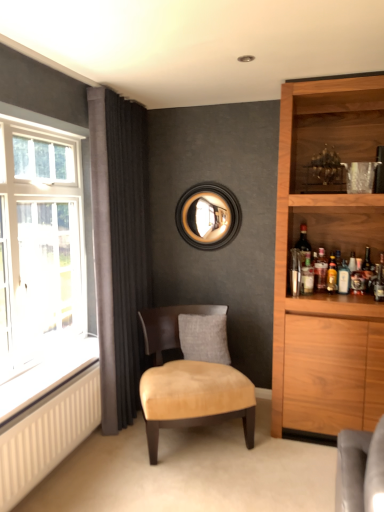
What do you see at coordinates (320, 270) in the screenshot? Image resolution: width=384 pixels, height=512 pixels. I see `translucent glass bottle at right, positioned as the second bottle in left-to-right order` at bounding box center [320, 270].

You are a GUI agent. You are given a task and a screenshot of the screen. Output one action in this format:
    pyautogui.click(x=<x>, y=<y>)
    Task: Click on the translucent glass bottle at right, which is the second bottle from right to left
    The width and height of the screenshot is (384, 512).
    Given the screenshot: What is the action you would take?
    pyautogui.click(x=320, y=270)

Locate an element on the screen. dark grey velvet curtains at left is located at coordinates pyautogui.click(x=119, y=248).

Image resolution: width=384 pixels, height=512 pixels. I want to click on suede-like beige chair at center, so click(189, 382).

Describe the element at coordinates (303, 244) in the screenshot. The image size is (384, 512). I see `matte dark brown wine bottle at right` at that location.

Where is `black wood mirror at upper center`? The image size is (384, 512). black wood mirror at upper center is located at coordinates (208, 216).

From the image's perspective, is suede-like beige chair at center positioned above or below translucent glass bottle at right, the 1th bottle in the left-to-right sequence?

Based on their image positions, suede-like beige chair at center is located beneath translucent glass bottle at right, the 1th bottle in the left-to-right sequence.

Is suede-like beige chair at center shorter than translucent glass bottle at right, the 1th bottle in the left-to-right sequence?

No, suede-like beige chair at center is not shorter than translucent glass bottle at right, the 1th bottle in the left-to-right sequence.

Who is bigger, matte dark brown wine bottle at right or clear glass window at left?

Bigger between the two is clear glass window at left.

From a real-world perspective, between matte dark brown wine bottle at right and clear glass window at left, who is vertically lower?

matte dark brown wine bottle at right.

How many degrees apart are the facing directions of matte dark brown wine bottle at right and clear glass window at left?

The facing directions of matte dark brown wine bottle at right and clear glass window at left are 86.7 degrees apart.

In the image, there is a clear glass window at left. At what (x,y) coordinates should I click in order to perform the action: click on wine bottle above it (from the image's perspective). Please return your answer as a coordinate pair (x, y). The height and width of the screenshot is (512, 384). Looking at the image, I should click on (303, 244).

How different are the orientations of translucent glass bottle at right, which is the second bottle from right to left, and black wood mirror at upper center in degrees?

They differ by 1.81 degrees in their facing directions.

From a real-world perspective, which is physically below, translucent glass bottle at right, positioned as the second bottle in left-to-right order, or black wood mirror at upper center?

translucent glass bottle at right, positioned as the second bottle in left-to-right order.

In the scene shown: Who is smaller, translucent glass bottle at right, which is the second bottle from right to left, or black wood mirror at upper center?

With smaller size is translucent glass bottle at right, which is the second bottle from right to left.

Which point is more distant from viewer, (x=319, y=286) or (x=179, y=215)?

Positioned behind is point (x=179, y=215).

Which bottle is the 1st one when counting from the front of the black wood mirror at upper center? Please provide its 2D coordinates.

[(320, 270)]

Looking at this image, who is bigger, black wood mirror at upper center or translucent glass bottle at right, positioned as the second bottle in left-to-right order?

black wood mirror at upper center is bigger.

Is black wood mirror at upper center far from translucent glass bottle at right, which is the second bottle from right to left?

Yes, black wood mirror at upper center and translucent glass bottle at right, which is the second bottle from right to left, are quite far apart.

At what (x,y) coordinates should I click in order to perform the action: click on bottle that appears on the left of matte dark brown wine bottle at right. Please return your answer as a coordinate pair (x, y). This screenshot has width=384, height=512. Looking at the image, I should click on (307, 274).

From a real-world perspective, is translucent glass bottle at right, the 1th bottle in the left-to-right sequence, located higher than matte dark brown wine bottle at right?

Actually, translucent glass bottle at right, the 1th bottle in the left-to-right sequence, is physically below matte dark brown wine bottle at right in the real world.

Is matte dark brown wine bottle at right completely or partially inside translucent glass bottle at right, the 1th bottle in the left-to-right sequence?

That's incorrect, matte dark brown wine bottle at right is not inside translucent glass bottle at right, the 1th bottle in the left-to-right sequence.

In the scene shown: Can you confirm if translucent glass bottle at right, the 1th bottle in the left-to-right sequence, is thinner than matte dark brown wine bottle at right?

Correct, the width of translucent glass bottle at right, the 1th bottle in the left-to-right sequence, is less than that of matte dark brown wine bottle at right.

Does gray fabric pillow at center appear on the left side of clear glass bottle at right?

Yes.

Which object is closer to the camera taking this photo, gray fabric pillow at center or clear glass bottle at right?

Positioned in front is gray fabric pillow at center.

Does point (221, 327) come in front of point (338, 288)?

That is False.

From the picture: Is gray fabric pillow at center taller than clear glass bottle at right?

Yes.

Does translucent glass bottle at right, positioned as the 3th bottle in right-to-left order, turn towards clear glass bottle at right?

No, translucent glass bottle at right, positioned as the 3th bottle in right-to-left order, is not oriented towards clear glass bottle at right.

Who is more distant, translucent glass bottle at right, the 1th bottle in the left-to-right sequence, or clear glass bottle at right?

clear glass bottle at right.

Can you confirm if translucent glass bottle at right, the 1th bottle in the left-to-right sequence, is shorter than clear glass bottle at right?

A: Yes, translucent glass bottle at right, the 1th bottle in the left-to-right sequence, is shorter than clear glass bottle at right.

Where is `chair in front of the translucent glass bottle at right, positioned as the 3th bottle in right-to-left order`? chair in front of the translucent glass bottle at right, positioned as the 3th bottle in right-to-left order is located at coordinates (189, 382).

This screenshot has width=384, height=512. Find the location of `wine bottle below the clear glass window at left (from a real-world perspective)`. wine bottle below the clear glass window at left (from a real-world perspective) is located at coordinates (303, 244).

Which object lies further to the anchor point matte dark brown wine bottle at right, translucent glass bottle at right, positioned as the 3th bottle in right-to-left order, or shiny dark glass bottle at right, the 1th bottle positioned from the right?

Based on the image, shiny dark glass bottle at right, the 1th bottle positioned from the right, appears to be further to matte dark brown wine bottle at right.

Considering their positions, is dark grey velvet curtains at left positioned further to white textured radiator at lower left than shiny dark glass bottle at right, arranged as the 3th bottle when viewed from the left?

shiny dark glass bottle at right, arranged as the 3th bottle when viewed from the left, is further to white textured radiator at lower left.

From the image, which object appears to be farther from clear glass window at left, suede-like beige chair at center or shiny dark glass bottle at right, arranged as the 3th bottle when viewed from the left?

shiny dark glass bottle at right, arranged as the 3th bottle when viewed from the left, is further to clear glass window at left.

Estimate the real-world distances between objects in this image. Which object is closer to translucent glass bottle at right, positioned as the 3th bottle in right-to-left order, matte dark brown wine bottle at right or white textured radiator at lower left?

Based on the image, matte dark brown wine bottle at right appears to be nearer to translucent glass bottle at right, positioned as the 3th bottle in right-to-left order.

Considering their positions, is shiny dark glass bottle at right, the 1th bottle positioned from the right, positioned closer to translucent glass bottle at right, positioned as the 3th bottle in right-to-left order, than clear glass bottle at right?

clear glass bottle at right lies closer to translucent glass bottle at right, positioned as the 3th bottle in right-to-left order, than the other object.

From the image, which object appears to be farther from clear glass window at left, white textured radiator at lower left or gray fabric pillow at center?

The object further to clear glass window at left is gray fabric pillow at center.

Which object lies nearer to the anchor point clear glass bottle at right, black wood mirror at upper center or translucent glass bottle at right, the 1th bottle in the left-to-right sequence?

translucent glass bottle at right, the 1th bottle in the left-to-right sequence, lies closer to clear glass bottle at right than the other object.

Estimate the real-world distances between objects in this image. Which object is closer to gray fabric pillow at center, clear glass window at left or translucent glass bottle at right, the 1th bottle in the left-to-right sequence?

The object closer to gray fabric pillow at center is translucent glass bottle at right, the 1th bottle in the left-to-right sequence.

Identify the location of radiator located between clear glass window at left and gray fabric pillow at center in the depth direction. (47, 434).

I want to click on curtain between white textured radiator at lower left and shiny dark glass bottle at right, the 1th bottle positioned from the right, so tap(119, 248).

Where is `bottle between gray fabric pillow at center and matte dark brown wine bottle at right`? The image size is (384, 512). bottle between gray fabric pillow at center and matte dark brown wine bottle at right is located at coordinates (307, 274).

At what (x,y) coordinates should I click in order to perform the action: click on beverage situated between gray fabric pillow at center and shiny dark glass bottle at right, the 1th bottle positioned from the right, from left to right. Please return your answer as a coordinate pair (x, y). Looking at the image, I should click on (343, 278).